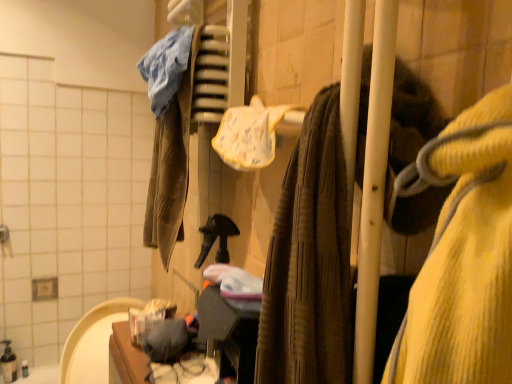
Question: Can you confirm if knitted wool sweater at center is taller than white textured cloth at center?

Choices:
 (A) yes
 (B) no

Answer: (A)

Question: Is knitted wool sweater at center to the left of white textured cloth at center from the viewer's perspective?

Choices:
 (A) yes
 (B) no

Answer: (B)

Question: Does knitted wool sweater at center touch white textured cloth at center?

Choices:
 (A) yes
 (B) no

Answer: (B)

Question: Can you confirm if knitted wool sweater at center is smaller than white textured cloth at center?

Choices:
 (A) yes
 (B) no

Answer: (B)

Question: Is there a large distance between knitted wool sweater at center and white textured cloth at center?

Choices:
 (A) no
 (B) yes

Answer: (A)

Question: Can you confirm if knitted wool sweater at center is positioned to the right of white textured cloth at center?

Choices:
 (A) no
 (B) yes

Answer: (B)

Question: Does white textured cloth at center appear on the right side of knitted wool sweater at center?

Choices:
 (A) yes
 (B) no

Answer: (B)

Question: From a real-world perspective, is white textured cloth at center positioned over knitted wool sweater at center based on gravity?

Choices:
 (A) no
 (B) yes

Answer: (B)

Question: Is white textured cloth at center with knitted wool sweater at center?

Choices:
 (A) yes
 (B) no

Answer: (B)

Question: Considering the relative positions of white textured cloth at center and knitted wool sweater at center in the image provided, is white textured cloth at center behind knitted wool sweater at center?

Choices:
 (A) yes
 (B) no

Answer: (A)

Question: Considering the relative sizes of white textured cloth at center and knitted wool sweater at center in the image provided, is white textured cloth at center taller than knitted wool sweater at center?

Choices:
 (A) no
 (B) yes

Answer: (A)

Question: Is white textured cloth at center not inside knitted wool sweater at center?

Choices:
 (A) no
 (B) yes

Answer: (B)

Question: Would you say white textured cloth at center is inside or outside knitted wool sweater at center?

Choices:
 (A) inside
 (B) outside

Answer: (B)